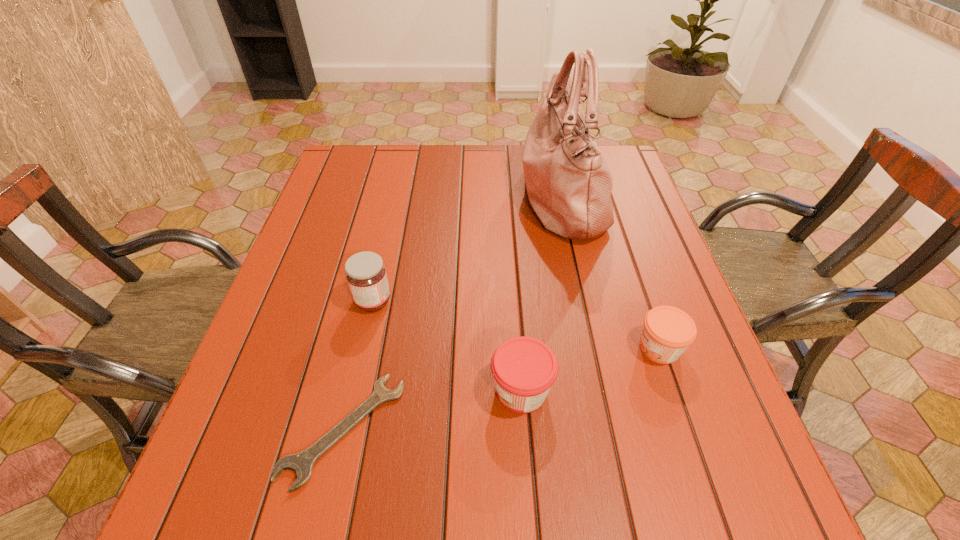
The height and width of the screenshot is (540, 960). I want to click on object that is at the far edge, so pos(569,184).

Find the location of a particular element. The width and height of the screenshot is (960, 540). object that is at the near edge is located at coordinates (301, 463).

Locate an element on the screen. The image size is (960, 540). object that is at the left edge is located at coordinates (301, 463).

The width and height of the screenshot is (960, 540). In order to click on handbag present at the right edge in this screenshot , I will do `click(569, 184)`.

This screenshot has height=540, width=960. Find the location of `jam that is at the right edge`. jam that is at the right edge is located at coordinates (667, 331).

Where is `object positioned at the near left corner`? object positioned at the near left corner is located at coordinates (301, 463).

Identify the location of object that is at the far right corner. (569, 184).

In the image, there is a desktop. Where is `vacant space at the far edge`? This screenshot has width=960, height=540. vacant space at the far edge is located at coordinates (446, 169).

You are a GUI agent. You are given a task and a screenshot of the screen. Output one action in this format:
    pyautogui.click(x=<x>, y=<y>)
    Task: Click on the free region at the left edge of the desktop
    
    Given the screenshot: What is the action you would take?
    pyautogui.click(x=324, y=245)

Locate an element on the screen. free space at the right edge is located at coordinates (687, 359).